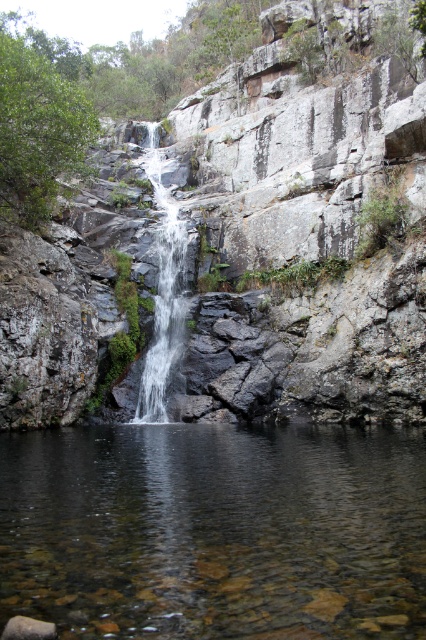
Can you confirm if clear water at center is taller than clear glass waterfall at center?

In fact, clear water at center may be shorter than clear glass waterfall at center.

Is point (172, 552) farther from camera compared to point (157, 236)?

No, (172, 552) is closer to viewer.

Image resolution: width=426 pixels, height=640 pixels. What do you see at coordinates (215, 531) in the screenshot?
I see `clear water at center` at bounding box center [215, 531].

The width and height of the screenshot is (426, 640). In order to click on clear water at center in this screenshot , I will do `click(215, 531)`.

Does point (71, 260) lie in front of point (396, 518)?

No, it is behind (396, 518).

Measure the distance between gray rock cliff at center and camera.

29.54 meters

The height and width of the screenshot is (640, 426). I want to click on gray rock cliff at center, so click(305, 221).

Is gray rock cliff at center above clear glass waterfall at center?

Correct, gray rock cliff at center is located above clear glass waterfall at center.

Is point (201, 376) behind point (184, 314)?

No, it is in front of (184, 314).

Describe the element at coordinates (305, 221) in the screenshot. I see `gray rock cliff at center` at that location.

Find the location of `gray rock cliff at center`. gray rock cliff at center is located at coordinates (305, 221).